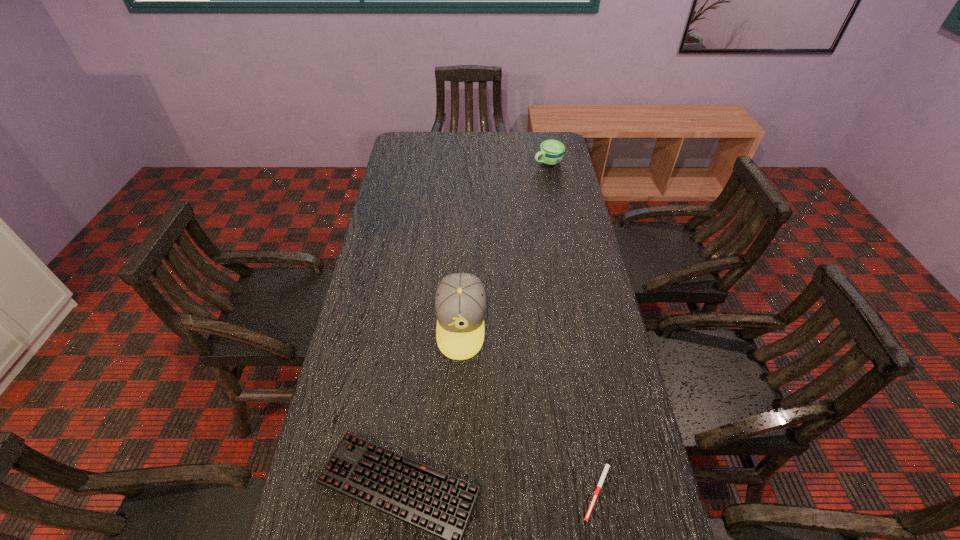
The image size is (960, 540). In order to click on object at the far right corner in this screenshot , I will do `click(551, 152)`.

Locate an element on the screen. vacant area at the far edge is located at coordinates (480, 155).

Find the location of `free spot at the left edge of the desktop`. free spot at the left edge of the desktop is located at coordinates (341, 390).

You are a GUI agent. You are given a task and a screenshot of the screen. Output one action in this format:
    pyautogui.click(x=<x>, y=<y>)
    Task: Click on the vacant area at the right edge
    This screenshot has height=540, width=960.
    Given the screenshot: What is the action you would take?
    pyautogui.click(x=599, y=346)

I want to click on free spot between the tallest object and the farthest object, so click(504, 244).

The height and width of the screenshot is (540, 960). I want to click on unoccupied area between the second farthest object and the pen, so click(530, 407).

The width and height of the screenshot is (960, 540). I want to click on empty space that is in between the farthest object and the shortest object, so click(573, 326).

Locate an element on the screen. This screenshot has width=960, height=540. empty space that is in between the farthest object and the tallest object is located at coordinates click(504, 244).

I want to click on vacant area that lies between the baseball cap and the cup, so click(504, 244).

Image resolution: width=960 pixels, height=540 pixels. What are the coordinates of `unoccupied position between the tallest object and the farthest object` in the screenshot? It's located at (504, 244).